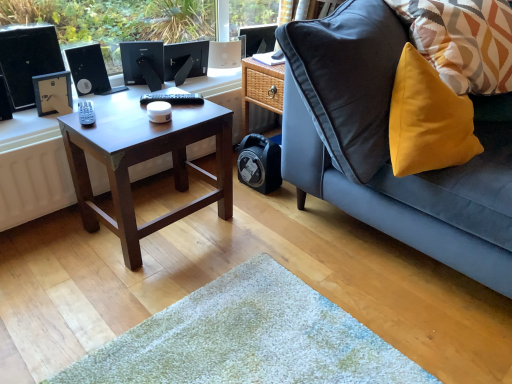
Question: Should I look upward or downward to see satin black monitor at upper center, the second computer monitor positioned from the left?

Choices:
 (A) up
 (B) down

Answer: (A)

Question: Does black matte desktop computer at left have a lesser width compared to satin black monitor at upper center, which ranks as the second computer monitor in right-to-left order?

Choices:
 (A) yes
 (B) no

Answer: (B)

Question: From a real-world perspective, is black matte desktop computer at left beneath satin black monitor at upper center, the second computer monitor positioned from the left?

Choices:
 (A) no
 (B) yes

Answer: (A)

Question: Is black matte desktop computer at left at the left side of satin black monitor at upper center, the second computer monitor positioned from the left?

Choices:
 (A) yes
 (B) no

Answer: (A)

Question: Can you confirm if black matte desktop computer at left is wider than satin black monitor at upper center, which ranks as the second computer monitor in right-to-left order?

Choices:
 (A) yes
 (B) no

Answer: (A)

Question: Is black matte desktop computer at left facing away from satin black monitor at upper center, the second computer monitor positioned from the left?

Choices:
 (A) no
 (B) yes

Answer: (A)

Question: Is black matte desktop computer at left next to satin black monitor at upper center, the second computer monitor positioned from the left?

Choices:
 (A) yes
 (B) no

Answer: (B)

Question: Considering the relative sizes of satin black monitor at center, the first computer monitor from the left, and yellow fabric pillow at upper right in the image provided, is satin black monitor at center, the first computer monitor from the left, taller than yellow fabric pillow at upper right?

Choices:
 (A) no
 (B) yes

Answer: (A)

Question: Does satin black monitor at center, the first computer monitor from the left, appear on the left side of yellow fabric pillow at upper right?

Choices:
 (A) no
 (B) yes

Answer: (B)

Question: Considering the relative sizes of satin black monitor at center, the first computer monitor from the left, and yellow fabric pillow at upper right in the image provided, is satin black monitor at center, the first computer monitor from the left, wider than yellow fabric pillow at upper right?

Choices:
 (A) no
 (B) yes

Answer: (A)

Question: Does satin black monitor at center, the first computer monitor from the left, appear on the right side of yellow fabric pillow at upper right?

Choices:
 (A) no
 (B) yes

Answer: (A)

Question: Does satin black monitor at center, which is the 3th computer monitor in right-to-left order, have a lesser width compared to yellow fabric pillow at upper right?

Choices:
 (A) yes
 (B) no

Answer: (A)

Question: Is satin black monitor at center, which is the 3th computer monitor in right-to-left order, outside of yellow fabric pillow at upper right?

Choices:
 (A) yes
 (B) no

Answer: (A)

Question: From the image's perspective, is dark brown wood coffee table at center under satin black monitor at center, the first computer monitor from the left?

Choices:
 (A) yes
 (B) no

Answer: (A)